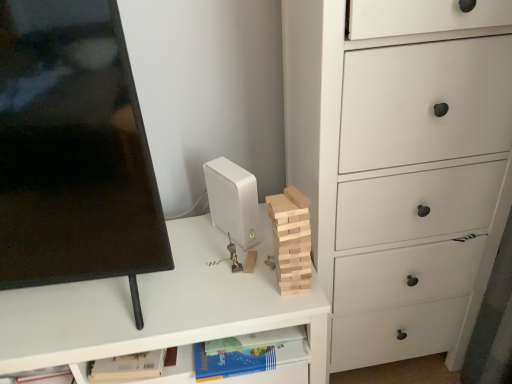
The width and height of the screenshot is (512, 384). In order to click on free space in front of white matte desktop computer at center in this screenshot , I will do `click(225, 280)`.